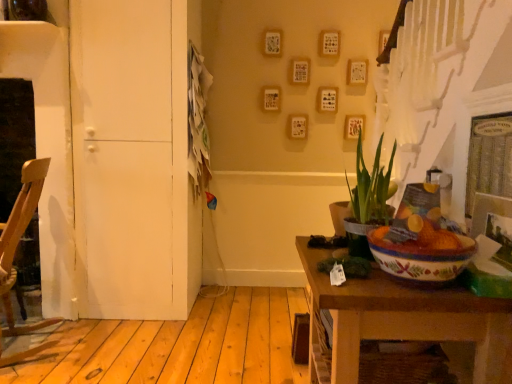
Question: Considering the relative sizes of wooden table at lower right and white matte door at left in the image provided, is wooden table at lower right shorter than white matte door at left?

Choices:
 (A) no
 (B) yes

Answer: (B)

Question: Are wooden table at lower right and white matte door at left far apart?

Choices:
 (A) yes
 (B) no

Answer: (A)

Question: Is wooden table at lower right aimed at white matte door at left?

Choices:
 (A) no
 (B) yes

Answer: (A)

Question: Is wooden table at lower right thinner than white matte door at left?

Choices:
 (A) no
 (B) yes

Answer: (B)

Question: Is wooden table at lower right closer to camera compared to white matte door at left?

Choices:
 (A) yes
 (B) no

Answer: (A)

Question: Can you see wooden table at lower right touching white matte door at left?

Choices:
 (A) yes
 (B) no

Answer: (B)

Question: Can you confirm if green leafy plant at center is smaller than wooden table at lower right?

Choices:
 (A) yes
 (B) no

Answer: (A)

Question: Is green leafy plant at center positioned with its back to wooden table at lower right?

Choices:
 (A) no
 (B) yes

Answer: (A)

Question: Can you confirm if green leafy plant at center is bigger than wooden table at lower right?

Choices:
 (A) yes
 (B) no

Answer: (B)

Question: Considering the relative positions of green leafy plant at center and wooden table at lower right in the image provided, is green leafy plant at center in front of wooden table at lower right?

Choices:
 (A) no
 (B) yes

Answer: (A)

Question: From the image's perspective, is green leafy plant at center over wooden table at lower right?

Choices:
 (A) no
 (B) yes

Answer: (B)

Question: Is green leafy plant at center taller than wooden table at lower right?

Choices:
 (A) yes
 (B) no

Answer: (B)

Question: Is white matte door at left thinner than wooden chair at left?

Choices:
 (A) yes
 (B) no

Answer: (B)